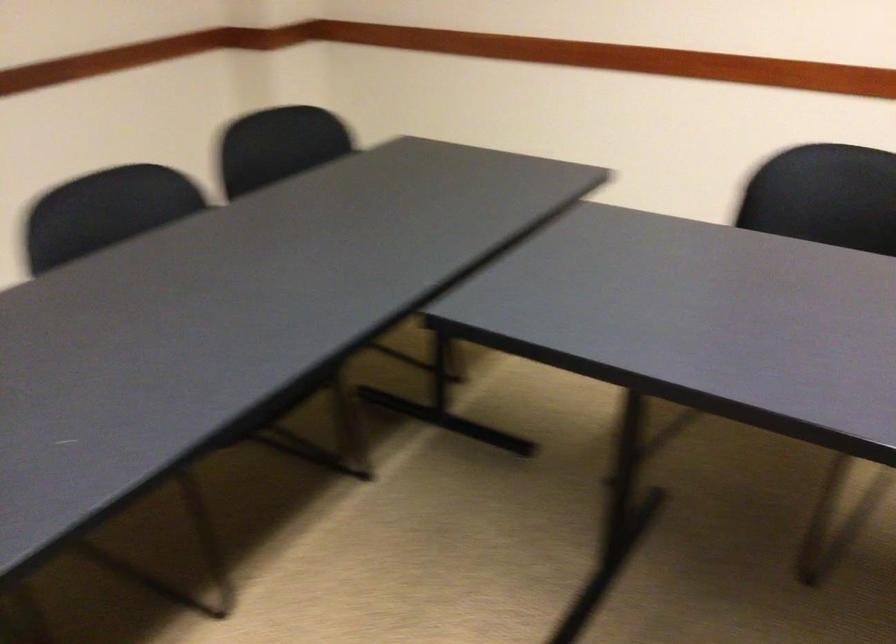
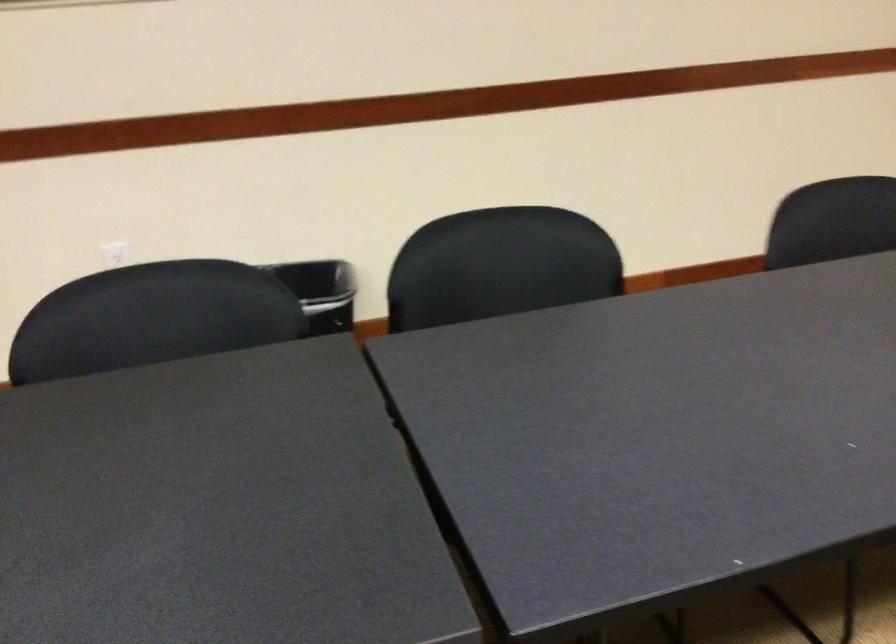
Question: The first image is from the beginning of the video and the second image is from the end. How did the camera likely rotate when shooting the video?

Choices:
 (A) Left
 (B) Right
 (C) Up
 (D) Down

Answer: (A)